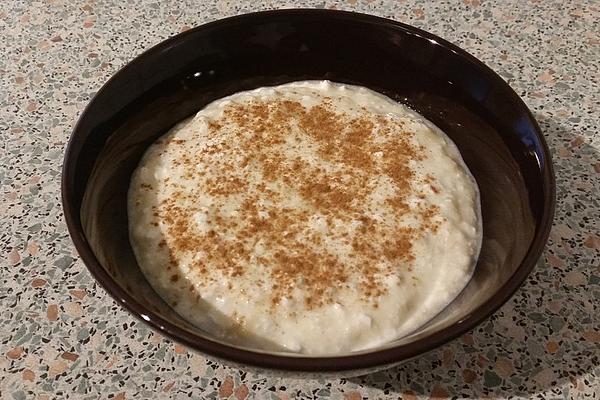
You are a GUI agent. You are given a task and a screenshot of the screen. Output one action in this format:
    pyautogui.click(x=<x>, y=<y>)
    Task: Click on the rim of bowl
    The width and height of the screenshot is (600, 400).
    Given the screenshot: What is the action you would take?
    pyautogui.click(x=530, y=116)